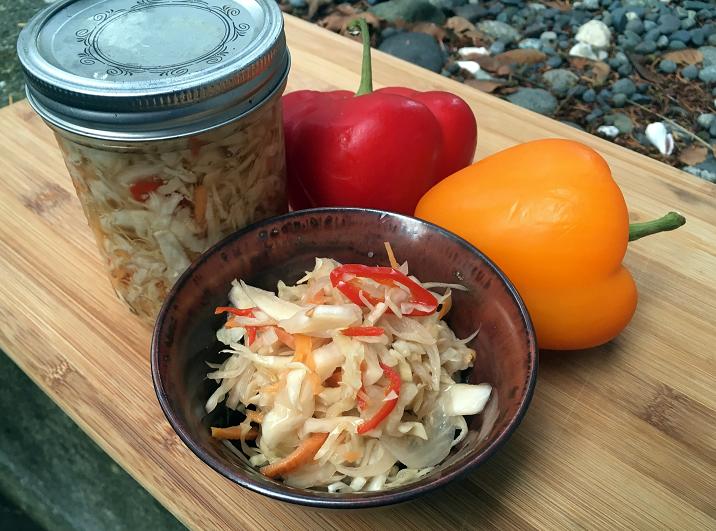
This screenshot has width=716, height=531. I want to click on mason jar, so click(168, 208).